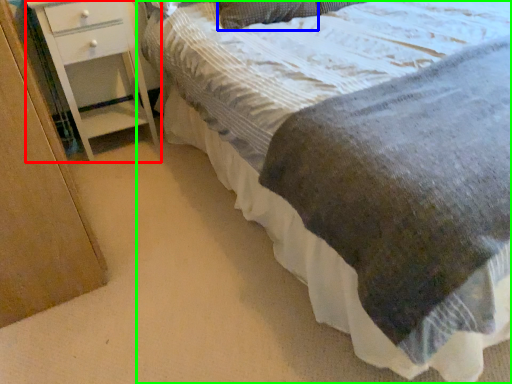
Question: Estimate the real-world distances between objects in this image. Which object is closer to chest of drawers (highlighted by a red box), pillow (highlighted by a blue box) or bed (highlighted by a green box)?

Choices:
 (A) pillow
 (B) bed

Answer: (A)